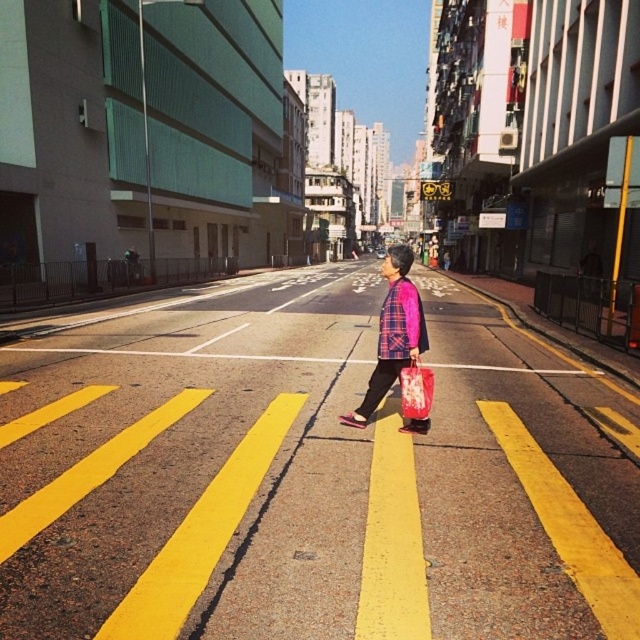
You are standing on the sidewalk and see a person wearing a plaid fabric shirt at center walking towards the right side of the frame. If you want to call out to them, will they be within hearing distance if your voice can carry up to 6 meters?

The plaid fabric shirt at center is 5.81 meters away from viewer. Since the distance is less than 6 meters, the person will be within hearing distance.

You are a delivery person who needs to hand over a package to the person in the image. The package is too large to fit in your arms, so you have to place it on the ground. Which object between the plaid fabric shirt at center and the matte pink shopping bag at center should you place the package closer to so that it is easier for the person to reach without moving their current items?

You should place the package closer to the matte pink shopping bag at center because the plaid fabric shirt at center is taller than the matte pink shopping bag at center, so the shopping bag is lower and easier to reach.

Consider the image. You are a delivery person who needs to hand over a package to the person wearing the plaid fabric shirt at center. However, you notice the person is holding a matte pink shopping bag at center. Can you reach the person without getting too close to the shopping bag?

The plaid fabric shirt at center is further to the viewer than the matte pink shopping bag at center, so you can reach the person without getting too close to the shopping bag.